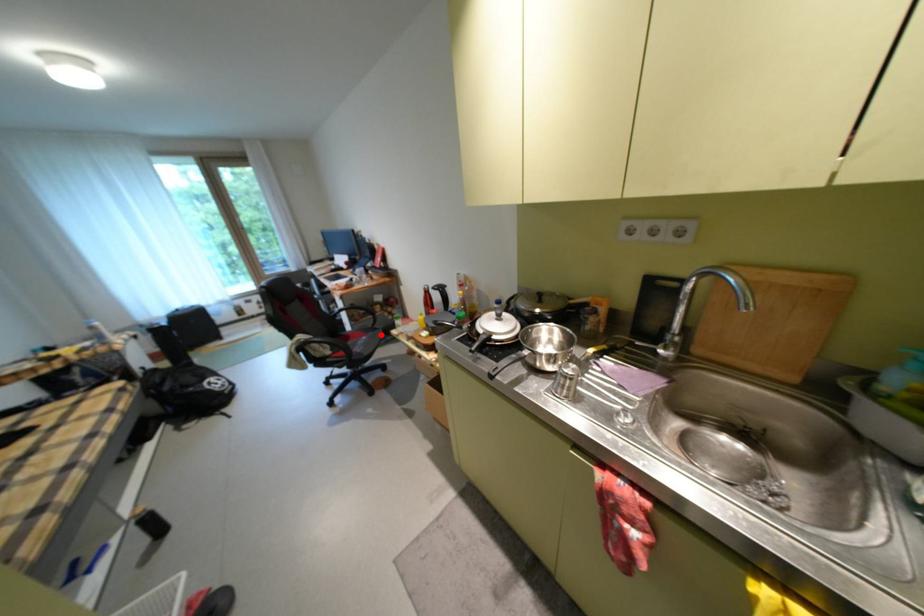
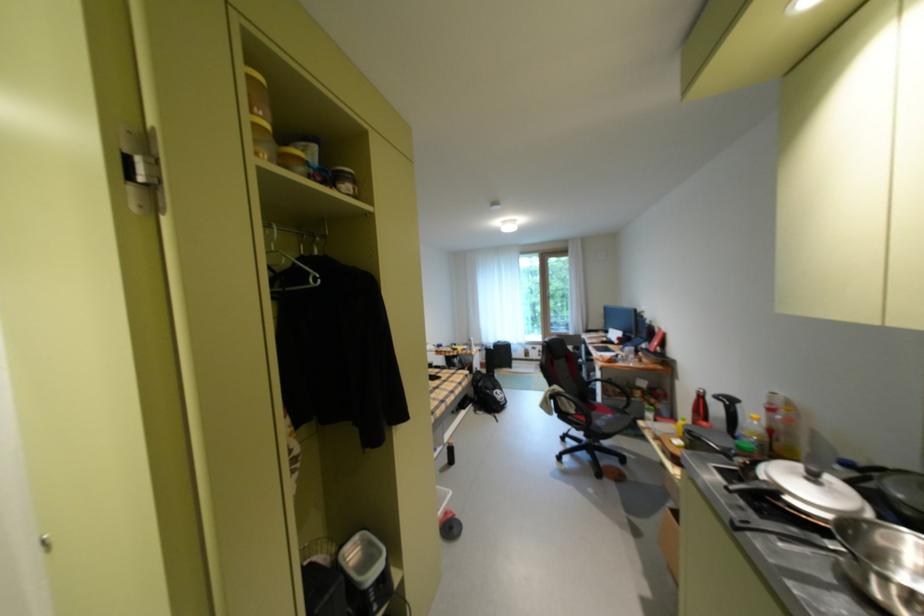
Locate, in the second image, the point that corresponds to the highlighted location in the first image.

(629, 416)